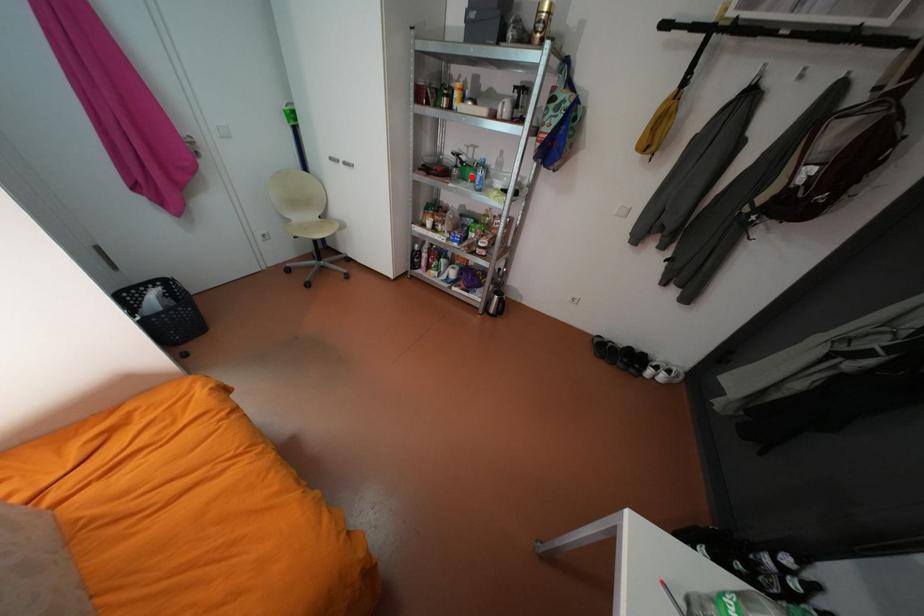
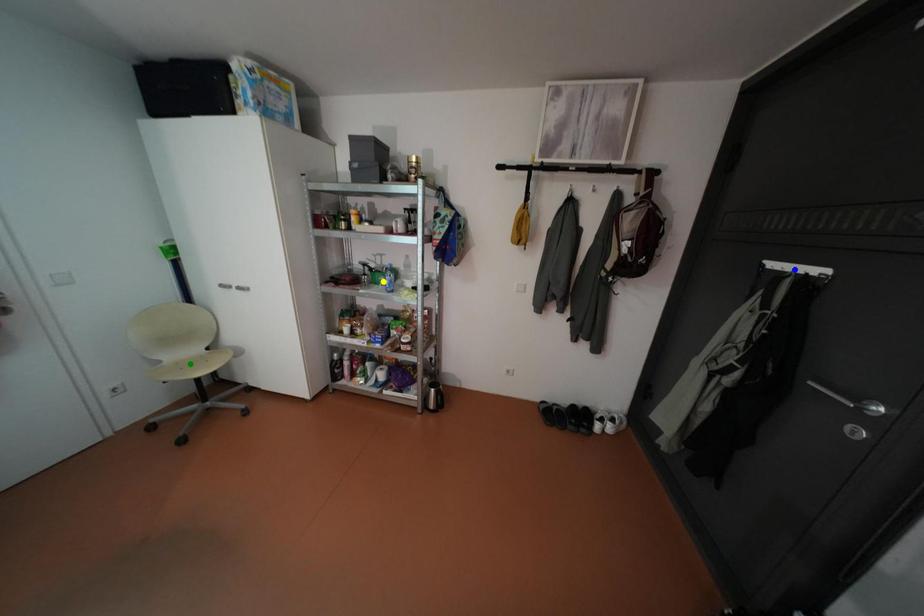
Question: I am providing you with two images of the same scene from different viewpoints. A red point is marked on the first image. You are given multiple points on the second image. Which spot in image 2 lines up with the point in image 1?

Choices:
 (A) green point
 (B) blue point
 (C) yellow point

Answer: (C)